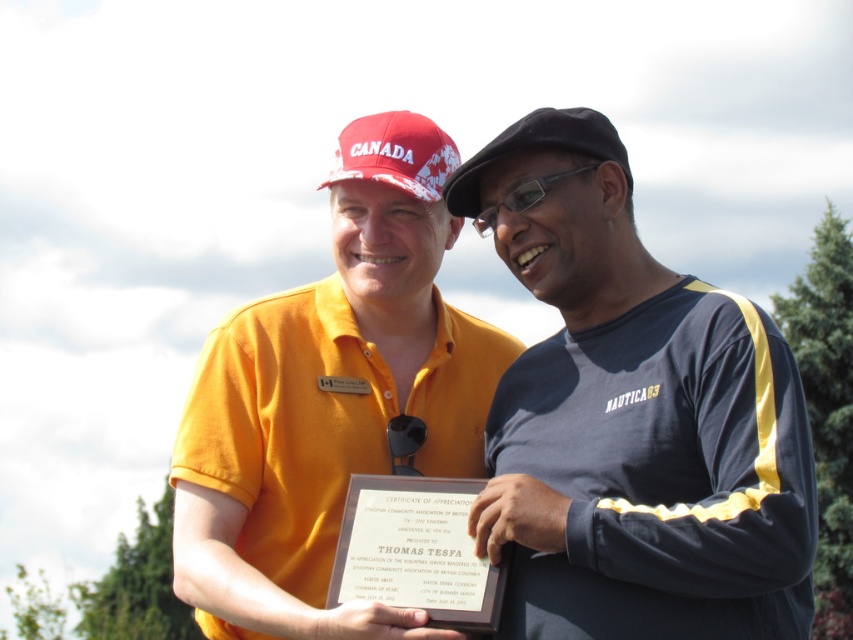
Question: Estimate the real-world distances between objects in this image. Which object is closer to the navy blue jersey at center?

Choices:
 (A) transparent plastic glasses at center
 (B) red fabric baseball cap at upper center

Answer: (A)

Question: Does red fabric baseball cap at upper center have a smaller size compared to black fabric baseball cap at upper center?

Choices:
 (A) yes
 (B) no

Answer: (B)

Question: Based on their relative distances, which object is farther from the black fabric baseball cap at upper center?

Choices:
 (A) matte yellow shirt at center
 (B) white paper plaque at center
 (C) navy blue jersey at center

Answer: (B)

Question: Is navy blue jersey at center to the left of red fabric baseball cap at upper center from the viewer's perspective?

Choices:
 (A) yes
 (B) no

Answer: (B)

Question: Which of the following is the closest to the observer?

Choices:
 (A) black fabric baseball cap at upper center
 (B) red fabric baseball cap at upper center
 (C) navy blue jersey at center
 (D) white paper plaque at center

Answer: (C)

Question: Is the position of red fabric baseball cap at upper center less distant than that of transparent plastic glasses at center?

Choices:
 (A) yes
 (B) no

Answer: (B)